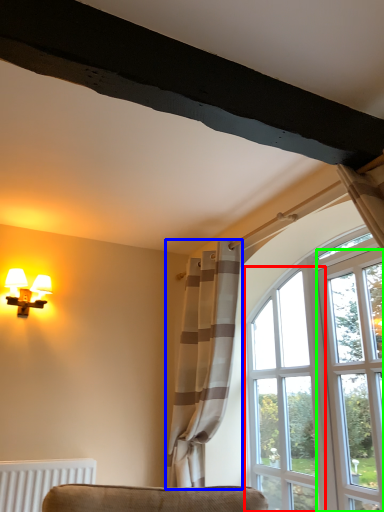
Question: Which object is the closest to the window (highlighted by a red box)? Choose among these: curtain (highlighted by a blue box) or screen door (highlighted by a green box).

Choices:
 (A) curtain
 (B) screen door

Answer: (B)